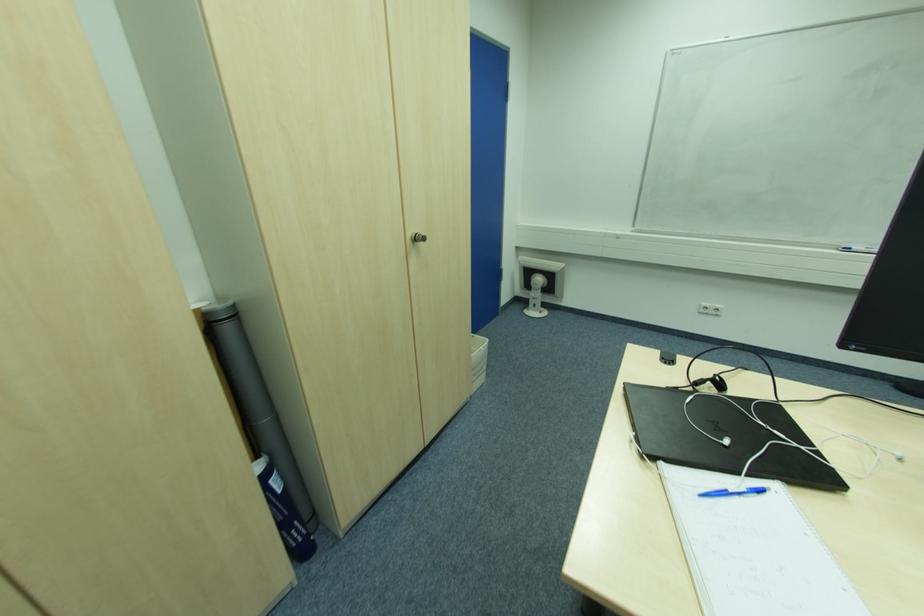
You are a GUI agent. You are given a task and a screenshot of the screen. Output one action in this format:
    pyautogui.click(x=<x>, y=<y>)
    Task: Click on the blue ballpoint pen
    
    Given the screenshot: What is the action you would take?
    pyautogui.click(x=734, y=492)